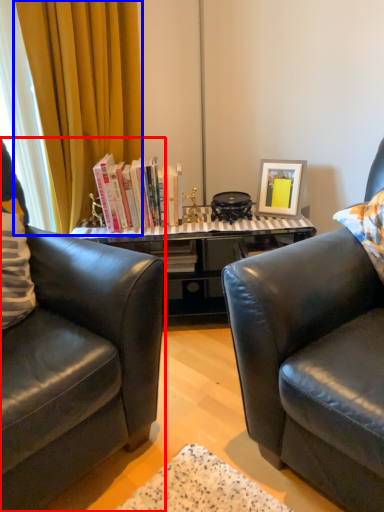
Question: Among these objects, which one is farthest to the camera, chair (highlighted by a red box) or curtain (highlighted by a blue box)?

Choices:
 (A) chair
 (B) curtain

Answer: (B)